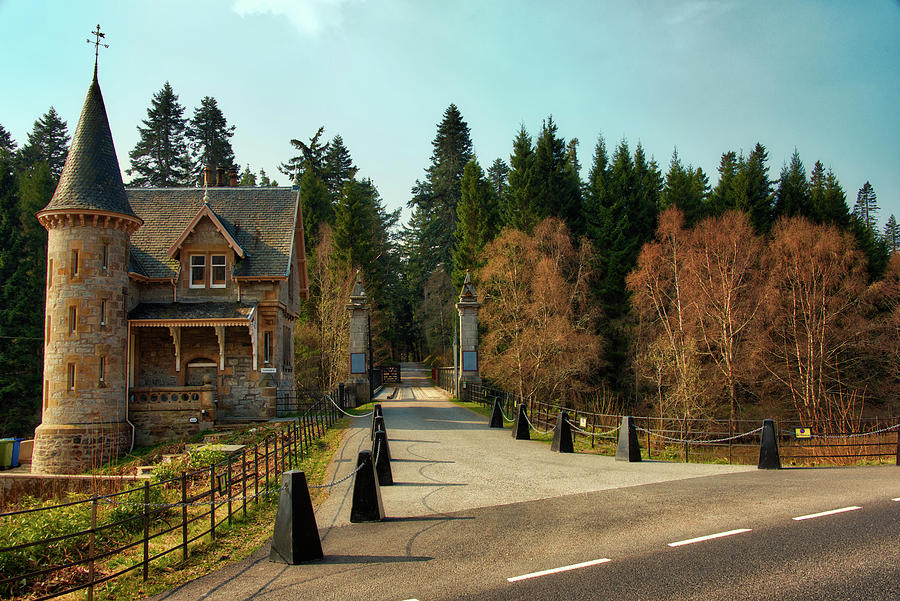
Find the location of a particular element. The width and height of the screenshot is (900, 601). window is located at coordinates (237, 278).